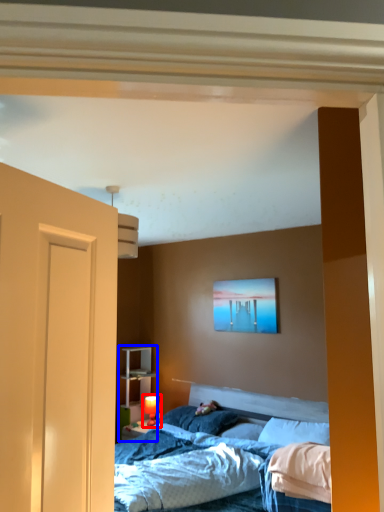
Question: Among these objects, which one is farthest to the camera, table lamp (highlighted by a red box) or dresser (highlighted by a blue box)?

Choices:
 (A) table lamp
 (B) dresser

Answer: (B)